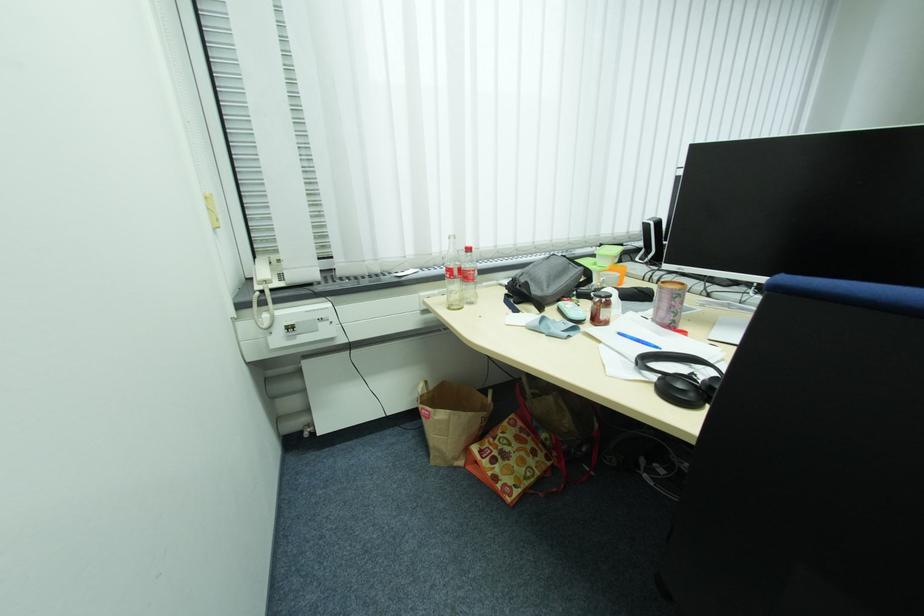
The image size is (924, 616). Describe the element at coordinates (508, 459) in the screenshot. I see `the patterned tote bag` at that location.